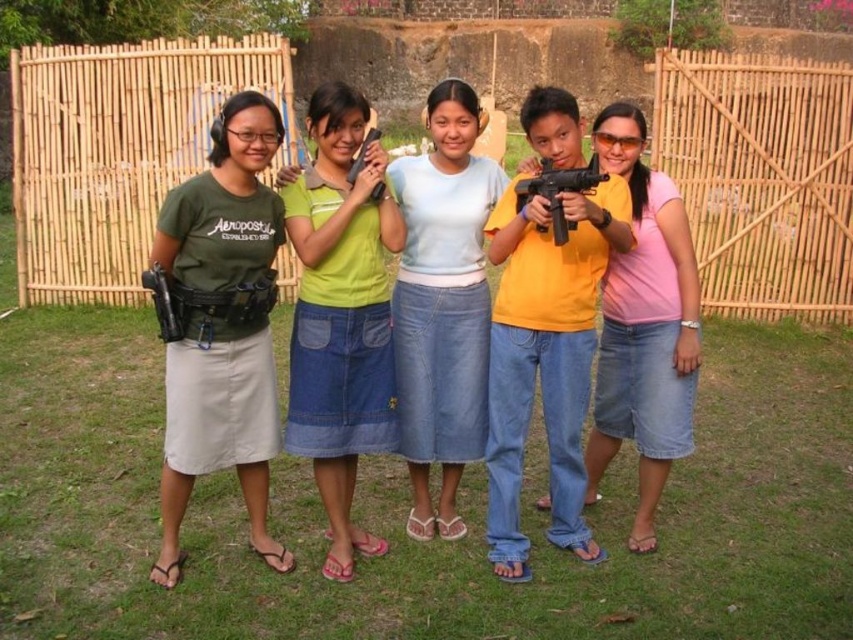
Question: Which object is the closest to the green denim skirt at center?

Choices:
 (A) light blue denim skirt at center
 (B) matte black gun at center
 (C) matte black toy gun at center

Answer: (A)

Question: Does matte black gun at left appear over matte black gun at center?

Choices:
 (A) yes
 (B) no

Answer: (B)

Question: Considering the real-world distances, which object is farthest from the matte black toy gun at center?

Choices:
 (A) green matte t-shirt at left
 (B) green denim skirt at center
 (C) matte black gun at left

Answer: (C)

Question: Which point is farther from the camera taking this photo?

Choices:
 (A) (172, 321)
 (B) (447, 324)
 (C) (525, 193)

Answer: (B)

Question: Does green denim skirt at center have a greater width compared to matte black gun at left?

Choices:
 (A) yes
 (B) no

Answer: (A)

Question: Does green denim skirt at center have a greater width compared to light blue denim skirt at center?

Choices:
 (A) yes
 (B) no

Answer: (A)